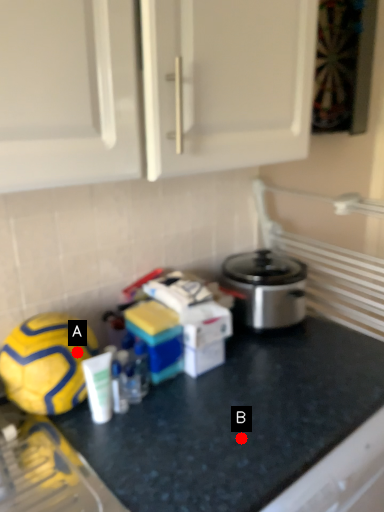
Question: Two points are circled on the image, labeled by A and B beside each circle. Which point is farther to the camera?

Choices:
 (A) A is further
 (B) B is further

Answer: (A)